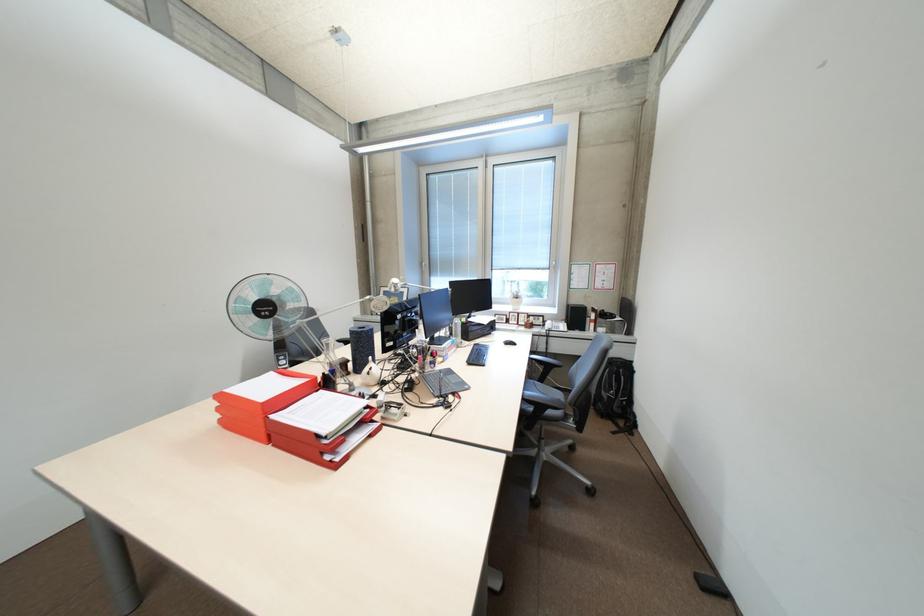
Identify the location of black backpack. The width and height of the screenshot is (924, 616). (614, 390).